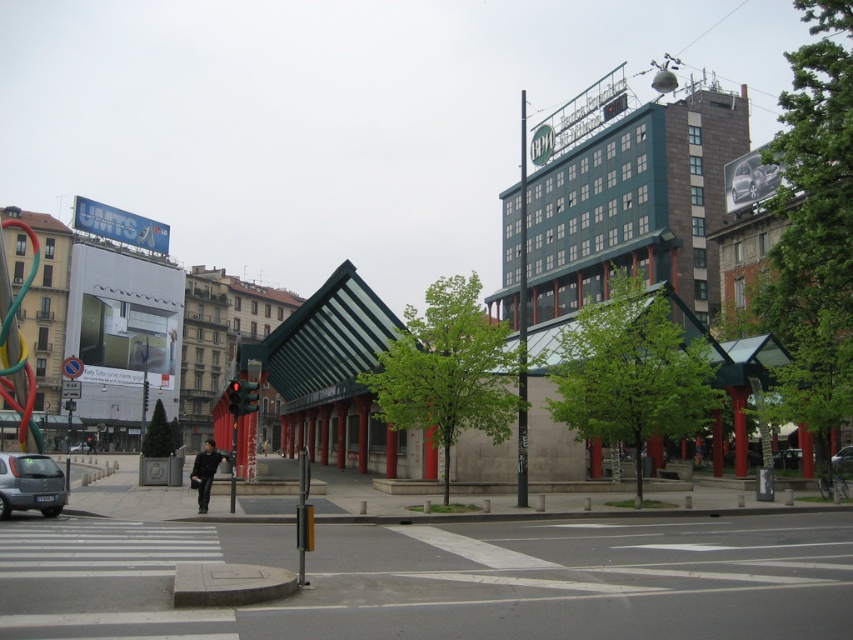
Who is positioned more to the left, white asphalt at center or silver metallic car at lower left?

From the viewer's perspective, silver metallic car at lower left appears more on the left side.

Does point (758, 536) lie behind point (22, 461)?

No, it is in front of (22, 461).

I want to click on white asphalt at center, so click(442, 580).